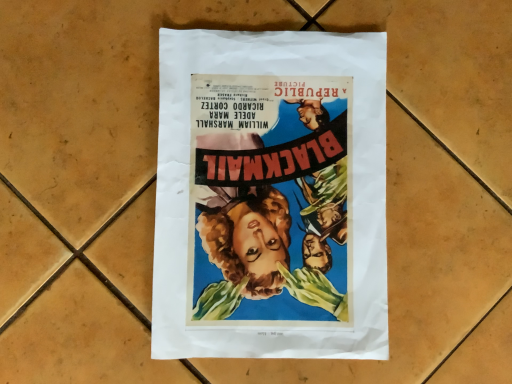
What are the coordinates of `vacant space situated above vintage paper poster at center (from a real-world perspective)` in the screenshot? It's located at (274, 185).